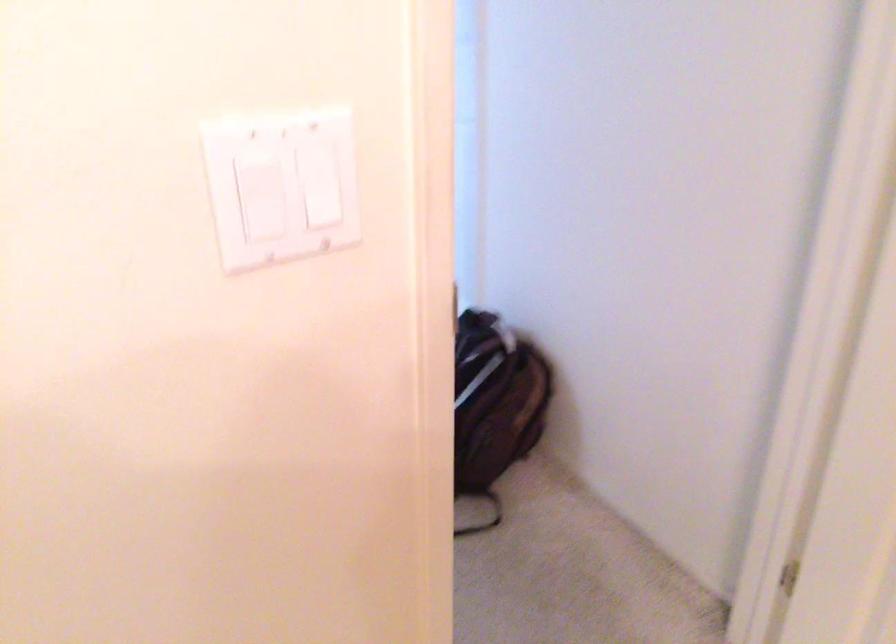
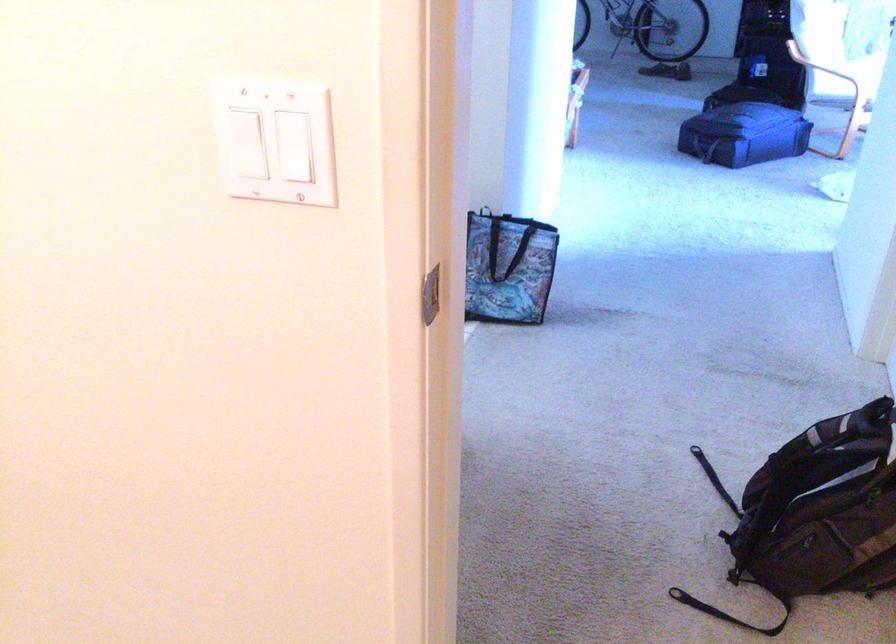
Find the pixel in the second image that matches pixel 343 210 in the first image.

(294, 146)